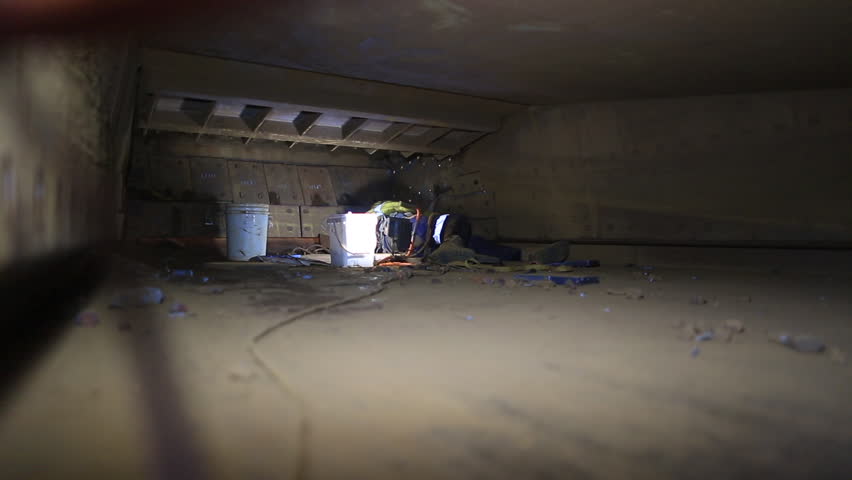
You are a GUI agent. You are given a task and a screenshot of the screen. Output one action in this format:
    pyautogui.click(x=<x>, y=<y>)
    Task: Click on the wall trim
    The image size is (852, 480).
    Given the screenshot: What is the action you would take?
    tap(670, 258)